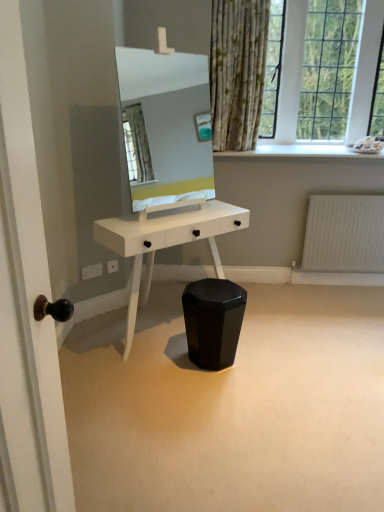
The image size is (384, 512). In order to click on vacant region above white matte radiator at lower right (from a real-world perspective) in this screenshot , I will do `click(362, 192)`.